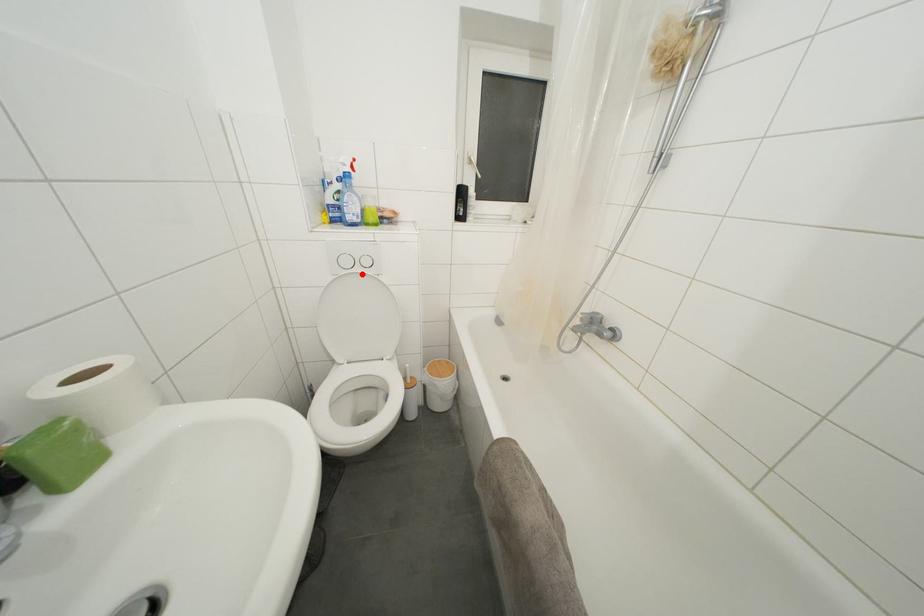
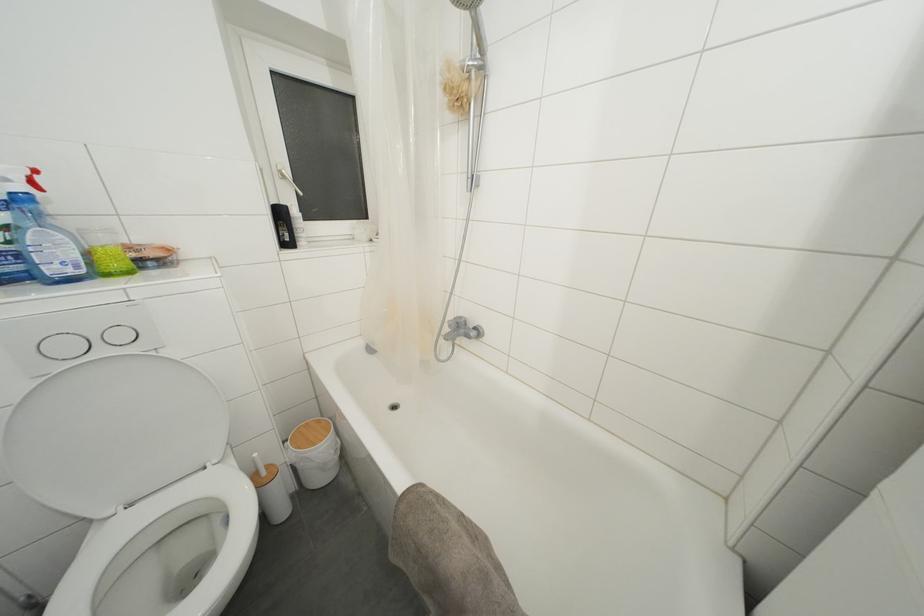
Where in the second image is the point corresponding to the highlighted location from the first image?

(106, 357)